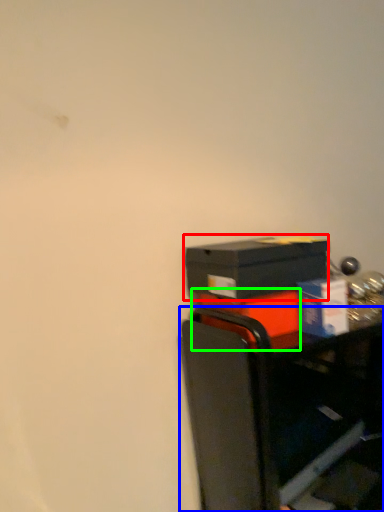
Question: Which object is positioned closest to box (highlighted by a red box)? Select from furniture (highlighted by a blue box) and box (highlighted by a green box).

Choices:
 (A) furniture
 (B) box

Answer: (B)